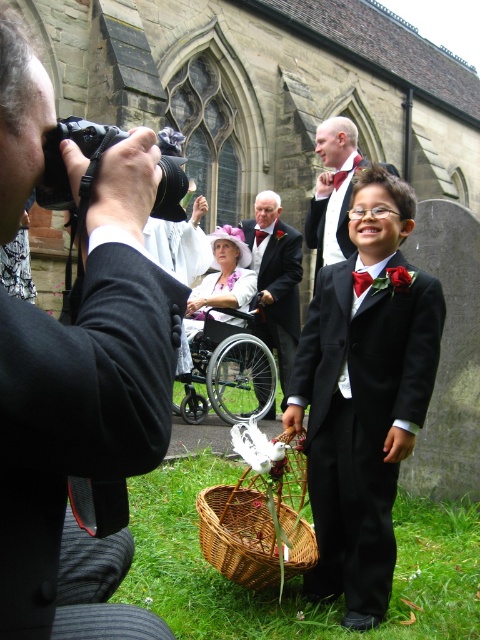
You are a guest at the wedding and you want to take a photo with the boy and his basket. The photographer says you can only stand behind one of them. Which one should you choose to ensure both the matte black suit at center and the woven brown basket at lower center are visible in your photo?

You should stand behind the woven brown basket at lower center because it is in front of the matte black suit at center. By standing behind the basket, both the basket and the suit will be visible in the photo.

You are the photographer at the wedding scene. You need to place a small note on the ground at the exact location of the point marked at coordinate point (260, 513). Where should you place the note relative to the woven brown basket at lower center?

The point (260, 513) corresponds to the woven brown basket at lower center, so you should place the note directly on top of the woven brown basket at lower center.